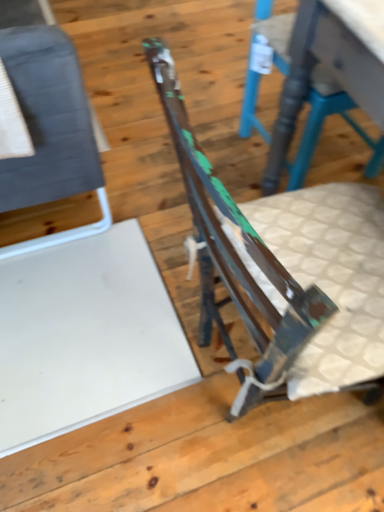
Question: Is rusty metal chair at center, positioned as the 2th chair in left-to-right order, smaller than rustic wood chair at center, which is the 1th chair from right to left?

Choices:
 (A) no
 (B) yes

Answer: (A)

Question: Is rusty metal chair at center, positioned as the 2th chair in left-to-right order, positioned far away from rustic wood chair at center, arranged as the 3th chair when viewed from the left?

Choices:
 (A) yes
 (B) no

Answer: (B)

Question: Considering the relative sizes of rusty metal chair at center, placed as the 2th chair when sorted from right to left, and rustic wood chair at center, arranged as the 3th chair when viewed from the left, in the image provided, is rusty metal chair at center, placed as the 2th chair when sorted from right to left, wider than rustic wood chair at center, arranged as the 3th chair when viewed from the left,?

Choices:
 (A) yes
 (B) no

Answer: (A)

Question: Would you say rusty metal chair at center, positioned as the 2th chair in left-to-right order, contains rustic wood chair at center, which is the 1th chair from right to left?

Choices:
 (A) yes
 (B) no

Answer: (B)

Question: Is rusty metal chair at center, placed as the 2th chair when sorted from right to left, aimed at rustic wood chair at center, arranged as the 3th chair when viewed from the left?

Choices:
 (A) yes
 (B) no

Answer: (B)

Question: In terms of width, does matte gray fabric chair at left, which is the first chair from left to right, look wider or thinner when compared to rustic wood chair at center, which is the 1th chair from right to left?

Choices:
 (A) thin
 (B) wide

Answer: (A)

Question: From the image's perspective, is matte gray fabric chair at left, which is the first chair from left to right, positioned above or below rustic wood chair at center, which is the 1th chair from right to left?

Choices:
 (A) above
 (B) below

Answer: (A)

Question: Based on their positions, is matte gray fabric chair at left, the third chair when ordered from right to left, located to the left or right of rustic wood chair at center, which is the 1th chair from right to left?

Choices:
 (A) right
 (B) left

Answer: (B)

Question: Is point (28, 75) positioned closer to the camera than point (259, 129)?

Choices:
 (A) farther
 (B) closer

Answer: (B)

Question: Is rustic wood chair at center, arranged as the 3th chair when viewed from the left, in front of or behind matte gray fabric chair at left, which is the first chair from left to right, in the image?

Choices:
 (A) front
 (B) behind

Answer: (B)

Question: Is rustic wood chair at center, arranged as the 3th chair when viewed from the left, wider or thinner than matte gray fabric chair at left, the third chair when ordered from right to left?

Choices:
 (A) wide
 (B) thin

Answer: (A)

Question: Is point [246, 132] positioned closer to the camera than point [97, 192]?

Choices:
 (A) farther
 (B) closer

Answer: (A)

Question: Considering the relative positions of rustic wood chair at center, which is the 1th chair from right to left, and matte gray fabric chair at left, the third chair when ordered from right to left, in the image provided, is rustic wood chair at center, which is the 1th chair from right to left, to the left or to the right of matte gray fabric chair at left, the third chair when ordered from right to left,?

Choices:
 (A) right
 (B) left

Answer: (A)

Question: Is rusty metal chair at center, placed as the 2th chair when sorted from right to left, wider or thinner than matte gray fabric chair at left, the third chair when ordered from right to left?

Choices:
 (A) thin
 (B) wide

Answer: (B)

Question: Considering the relative positions of rusty metal chair at center, placed as the 2th chair when sorted from right to left, and matte gray fabric chair at left, the third chair when ordered from right to left, in the image provided, is rusty metal chair at center, placed as the 2th chair when sorted from right to left, to the left or to the right of matte gray fabric chair at left, the third chair when ordered from right to left,?

Choices:
 (A) left
 (B) right

Answer: (B)